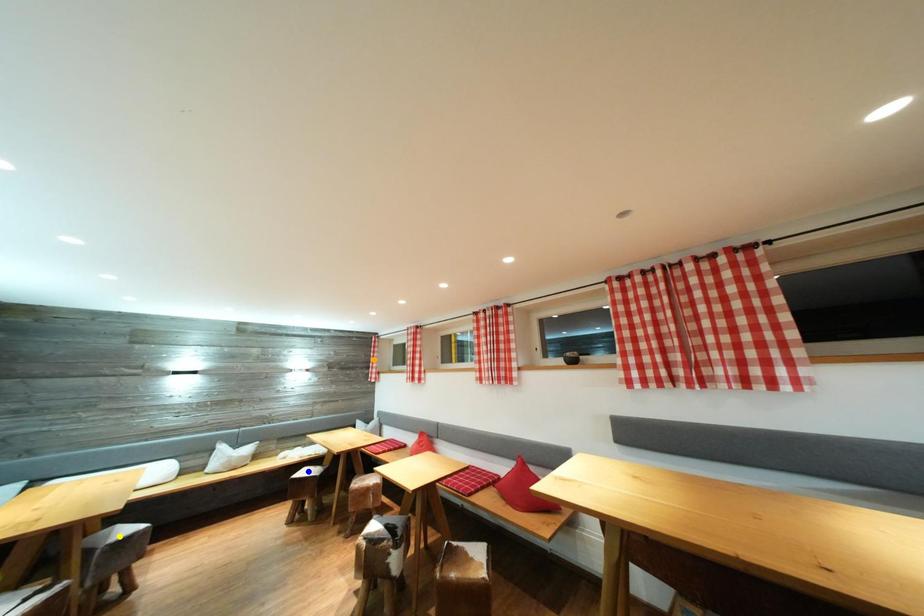
Order these from nearest to farthest:
- blue point
- yellow point
- orange point

yellow point
blue point
orange point